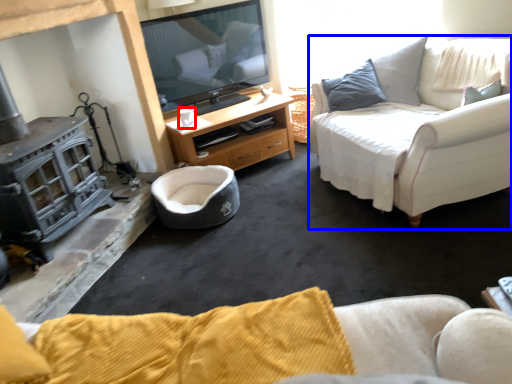
Question: Which object is closer to the camera taking this photo, coffee cup (highlighted by a red box) or studio couch (highlighted by a blue box)?

Choices:
 (A) coffee cup
 (B) studio couch

Answer: (B)